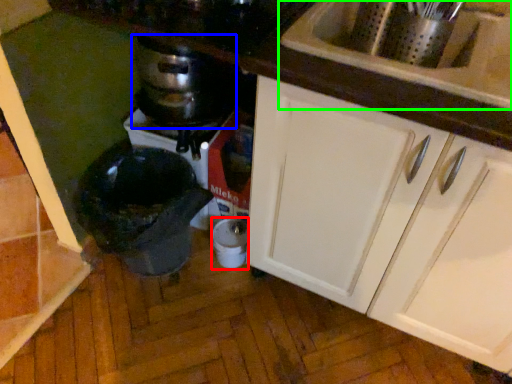
Question: Based on their relative distances, which object is nearer to appliance (highlighted by a red box)? Choose from kitchen appliance (highlighted by a blue box) and sink (highlighted by a green box).

Choices:
 (A) kitchen appliance
 (B) sink

Answer: (A)